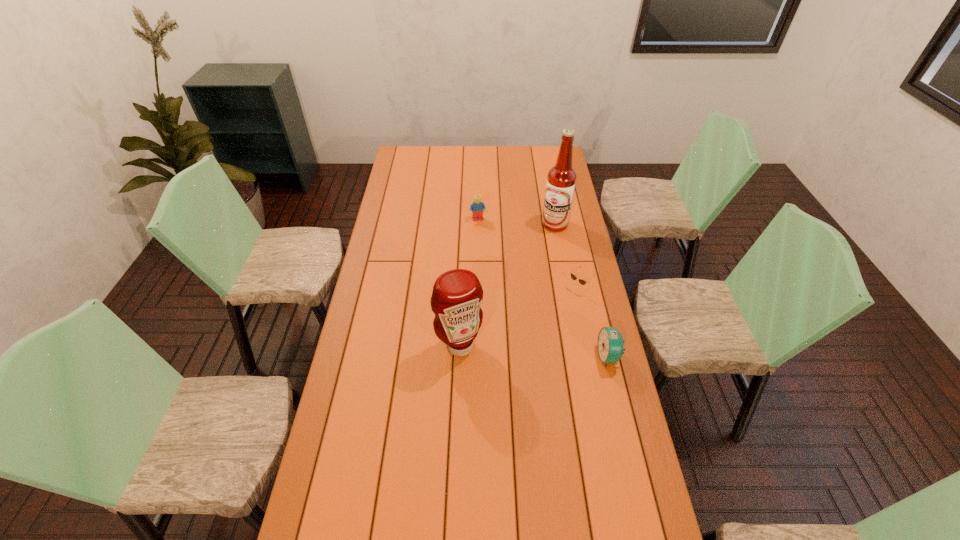
This screenshot has height=540, width=960. In order to click on condiment in this screenshot , I will do `click(457, 294)`.

Find the location of a particular element. alarm clock is located at coordinates (610, 344).

Identify the location of alcohol. (561, 180).

Where is `the third nearest object`? This screenshot has width=960, height=540. the third nearest object is located at coordinates (x=582, y=282).

Locate an element on the screen. the shortest object is located at coordinates (582, 282).

Identify the location of Lego. (476, 208).

Locate an element on the screen. This screenshot has height=540, width=960. vacant space located on the left of the condiment is located at coordinates (385, 346).

Find the location of a particular element. Image resolution: width=960 pixels, height=540 pixels. free location located on the front-facing side of the alarm clock is located at coordinates 528,356.

The height and width of the screenshot is (540, 960). I want to click on free region located on the front-facing side of the alarm clock, so click(574, 356).

The image size is (960, 540). I want to click on vacant position located 0.210m on the front-facing side of the alarm clock, so coord(537,356).